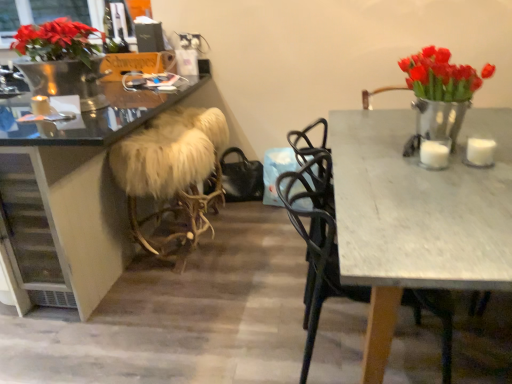
Question: Is white marble table at right shorter than white matte candle at right, placed as the 2th candle when sorted from front to back?

Choices:
 (A) no
 (B) yes

Answer: (A)

Question: Does white marble table at right have a greater height compared to white matte candle at right, the third candle in the left-to-right sequence?

Choices:
 (A) no
 (B) yes

Answer: (B)

Question: Is white marble table at right located outside white matte candle at right, which is counted as the 1th candle, starting from the right?

Choices:
 (A) yes
 (B) no

Answer: (A)

Question: Is white marble table at right thinner than white matte candle at right, which is the second candle in bottom-to-top order?

Choices:
 (A) yes
 (B) no

Answer: (B)

Question: Is white marble table at right next to white matte candle at right, the second candle when ordered from top to bottom, and touching it?

Choices:
 (A) no
 (B) yes

Answer: (A)

Question: From the image's perspective, is white marble table at right beneath white matte candle at right, which is the second candle in bottom-to-top order?

Choices:
 (A) no
 (B) yes

Answer: (B)

Question: Is white fur-covered stool at center with black metal chair at upper right?

Choices:
 (A) yes
 (B) no

Answer: (B)

Question: From a real-world perspective, does white fur-covered stool at center stand above black metal chair at upper right?

Choices:
 (A) yes
 (B) no

Answer: (B)

Question: Would you say white fur-covered stool at center contains black metal chair at upper right?

Choices:
 (A) yes
 (B) no

Answer: (B)

Question: Can you confirm if white fur-covered stool at center is thinner than black metal chair at upper right?

Choices:
 (A) no
 (B) yes

Answer: (B)

Question: Does white fur-covered stool at center turn towards black metal chair at upper right?

Choices:
 (A) no
 (B) yes

Answer: (A)

Question: Is white fur-covered stool at center outside black metal chair at upper right?

Choices:
 (A) yes
 (B) no

Answer: (A)

Question: Is white marble table at right smaller than white fur-covered stool at center?

Choices:
 (A) no
 (B) yes

Answer: (A)